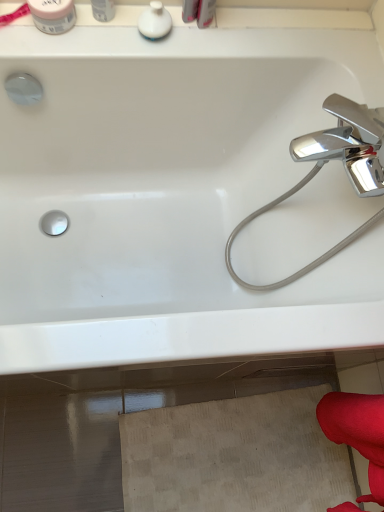
This screenshot has height=512, width=384. Find the location of `vacant space in front of white matte jar at upper left, the 3th toiletry viewed from the right`. vacant space in front of white matte jar at upper left, the 3th toiletry viewed from the right is located at coordinates (41, 51).